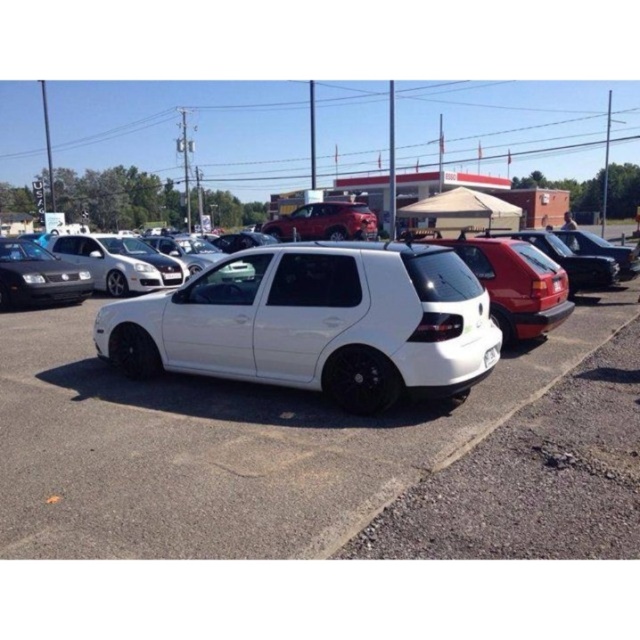
You are standing in the parking lot and want to take a photo of the white matte hatchback at center and the matte black car at left. Which car should you focus on first to ensure both are in the frame without moving the camera?

The white matte hatchback at center is closer to the viewer than the matte black car at left, so focus on the white matte hatchback at center first to ensure both are in the frame without moving the camera.

You are driving a car that requires a 10 meter turning radius. You need to navigate around the white matte hatchback at center and the matte black car at left. Can you safely make the turn without hitting either car?

The white matte hatchback at center is 8.98 meters away from the matte black car at left. Since your car requires a 10 meter turning radius, the distance between the two cars is shorter than needed. Therefore, you cannot safely make the turn without risking a collision.

In the scene shown: You are standing at the entrance of the gas station and want to find the glossy red hatchback at center. According to the coordinates provided, in which direction should you look relative to your current position?

The glossy red hatchback at center is located at point coordinates, so you should look towards the center of the parking lot where the beige tent is set up near center right.